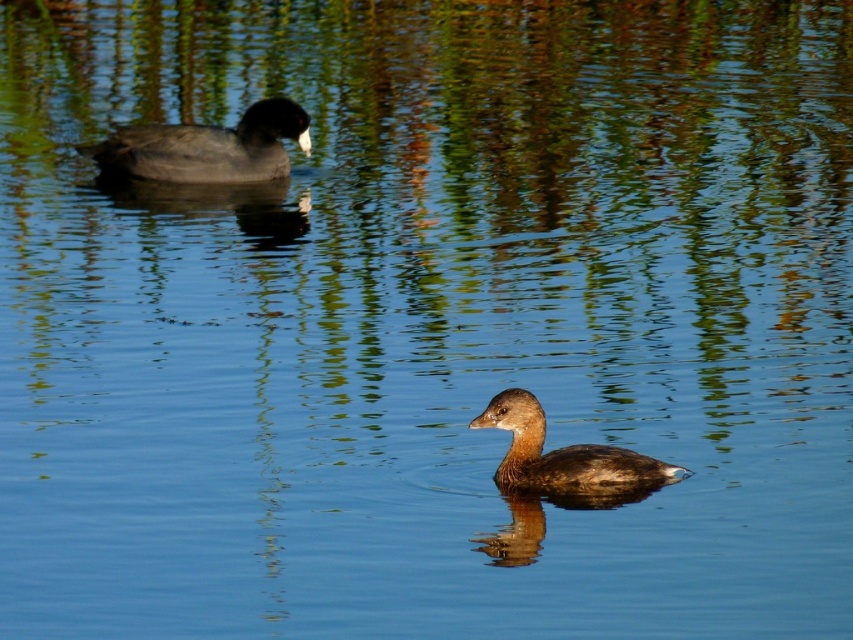
You are a birdwatcher observing the scene. You notice two ducks in the water. The dark gray matte duck at left and the brown matte duck at center. Which duck is closer to you, the observer?

The dark gray matte duck at left is closer to you because the brown matte duck at center is behind it.

You are a photographer trying to capture the reflection of the dark gray matte duck at left in the water. Based on the scene description, where should you position your camera to ensure the reflection is fully visible?

The dark gray matte duck at left is located at point (207, 147). To capture its reflection fully, position the camera directly above this point at a low angle to align with the water surface.